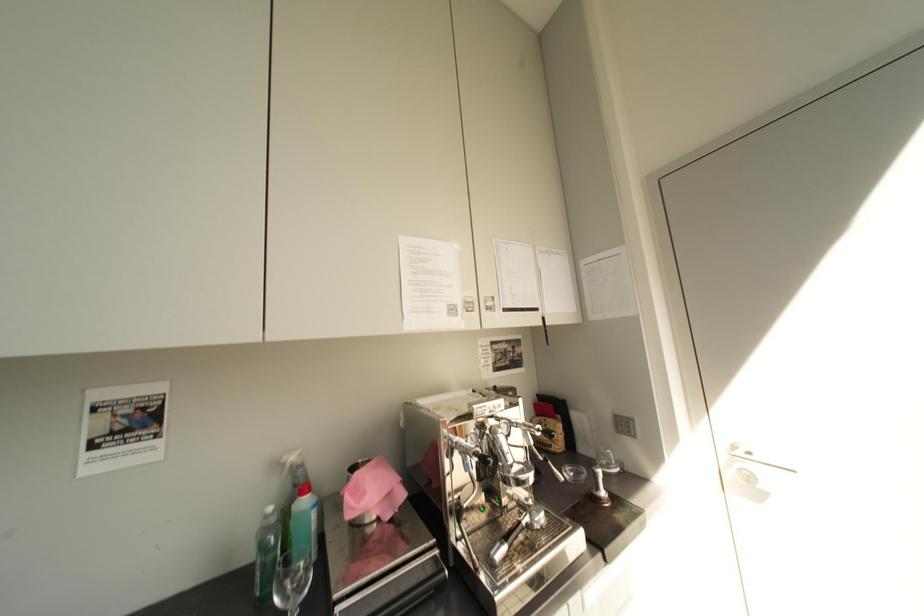
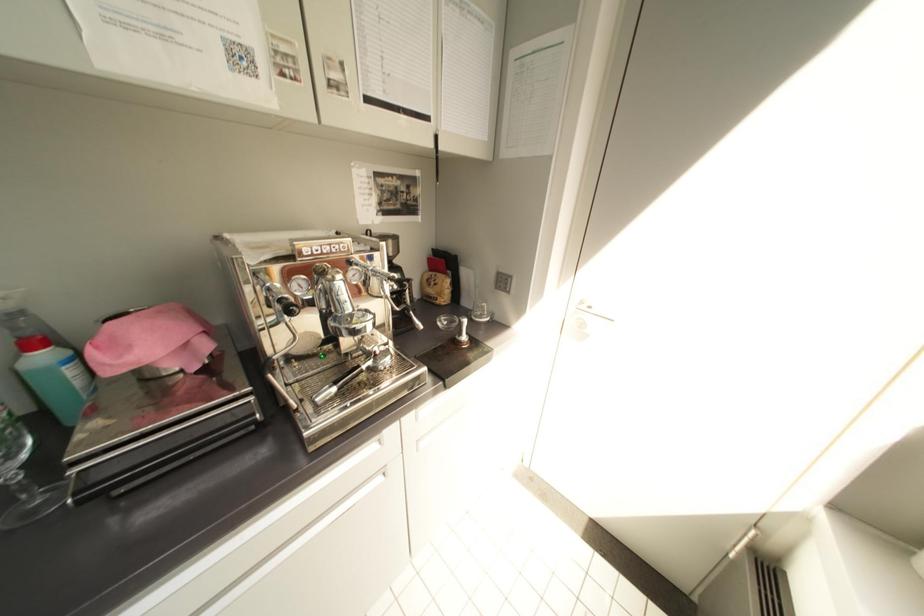
Based on the continuous images, in which direction is the camera rotating?

The rotation direction of the camera is right-down.